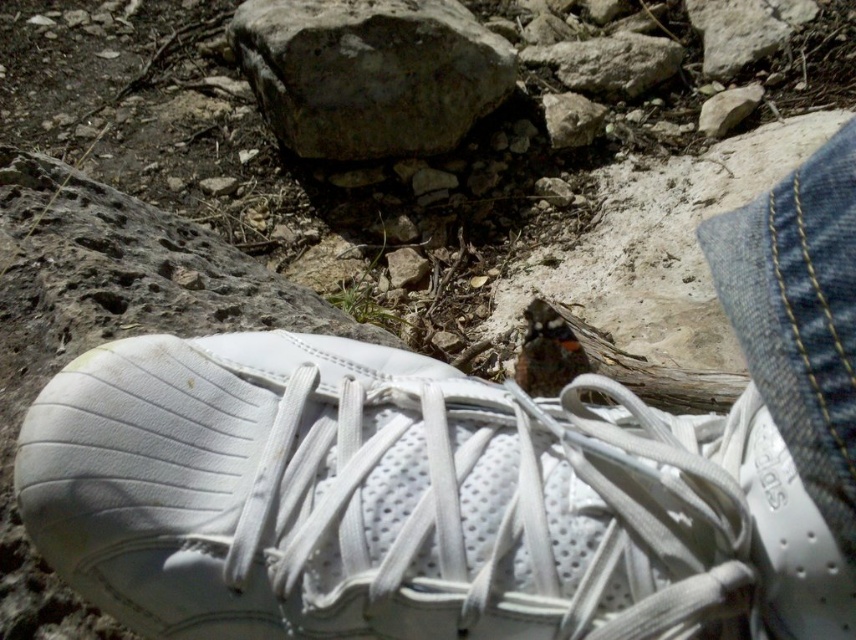
You are standing in an outdoor area with a white athletic shoe at the center. There is a point marked at coordinates [372,497]. Which object is this point located on?

The point at [372,497] is located on the white leather shoe at center.

You are trying to decide whether to place the white leather shoe at center on top of the smooth gray rock at upper center. Based on their heights, will the shoe fit stably on the rock?

The white leather shoe at center is not as tall as the smooth gray rock at upper center, so the shoe will fit stably on the rock since it is shorter and less likely to tip over.